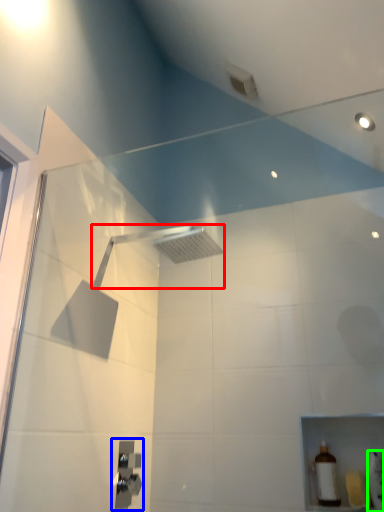
Question: Which object is the closest to the shower (highlighted by a red box)? Choose among these: shower (highlighted by a blue box) or toiletry (highlighted by a green box).

Choices:
 (A) shower
 (B) toiletry

Answer: (A)